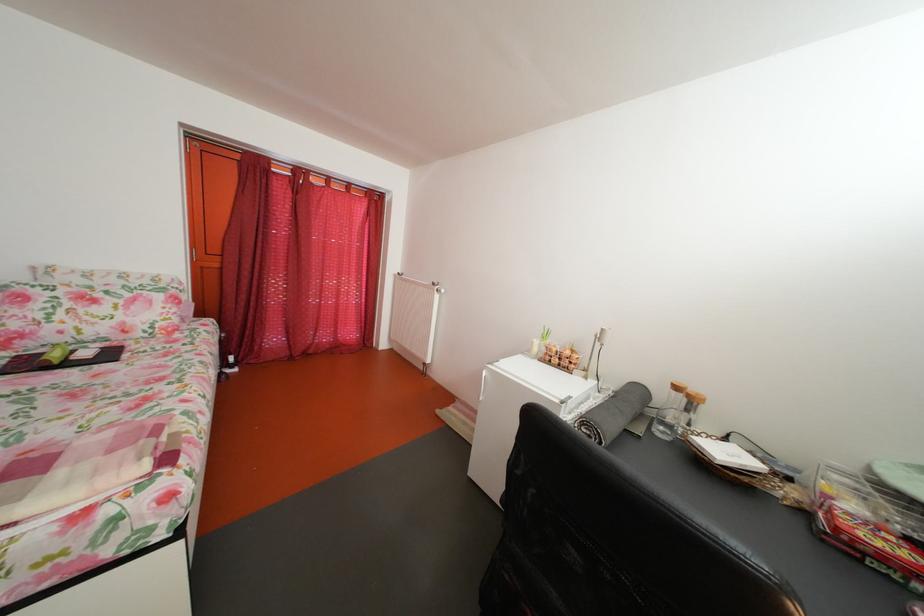
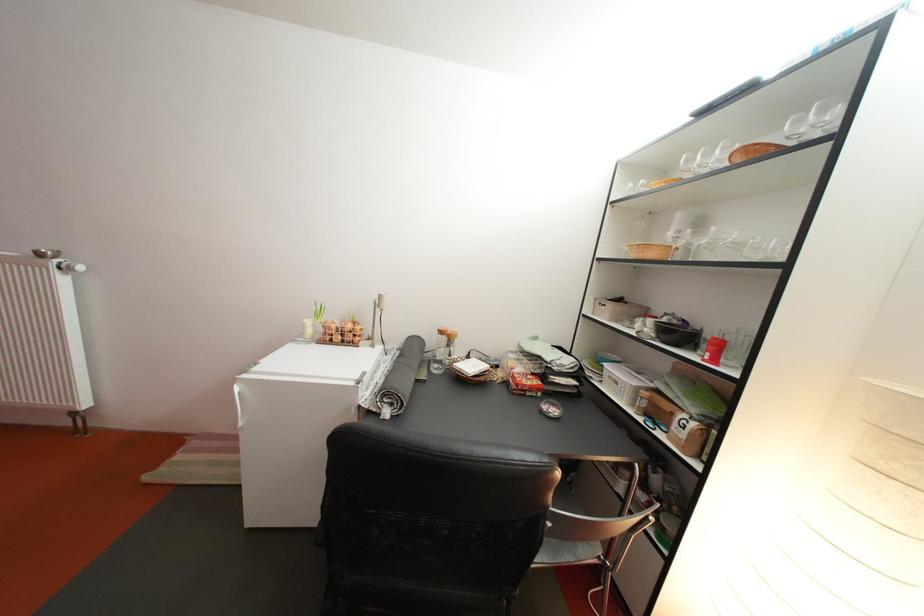
In the second image, find the point that corresponds to point (675, 403) in the first image.

(444, 346)